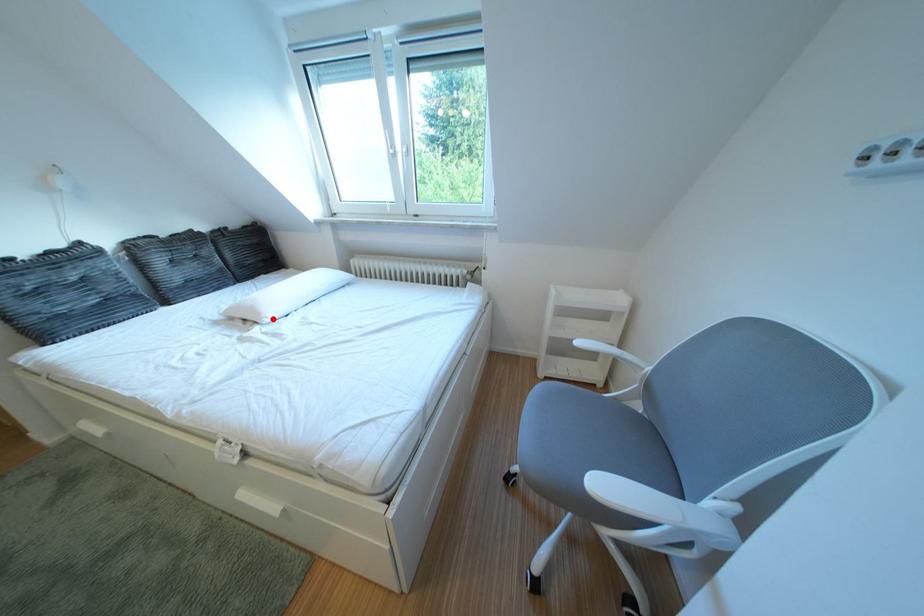
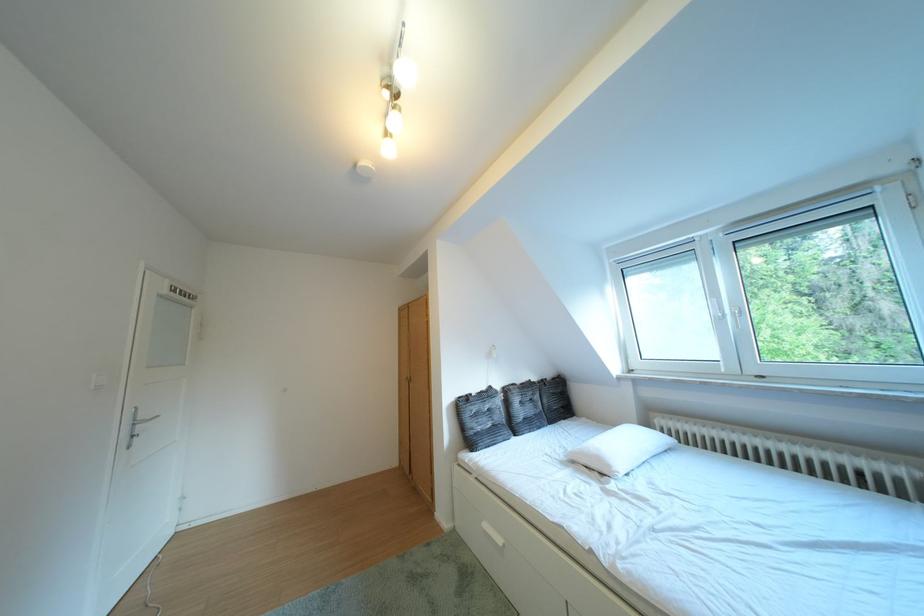
Question: I am providing you with two images of the same scene from different viewpoints. A red point is shown in image1. For the corresponding object point in image2, is it positioned nearer or farther from the camera?

Choices:
 (A) Nearer
 (B) Farther

Answer: (B)